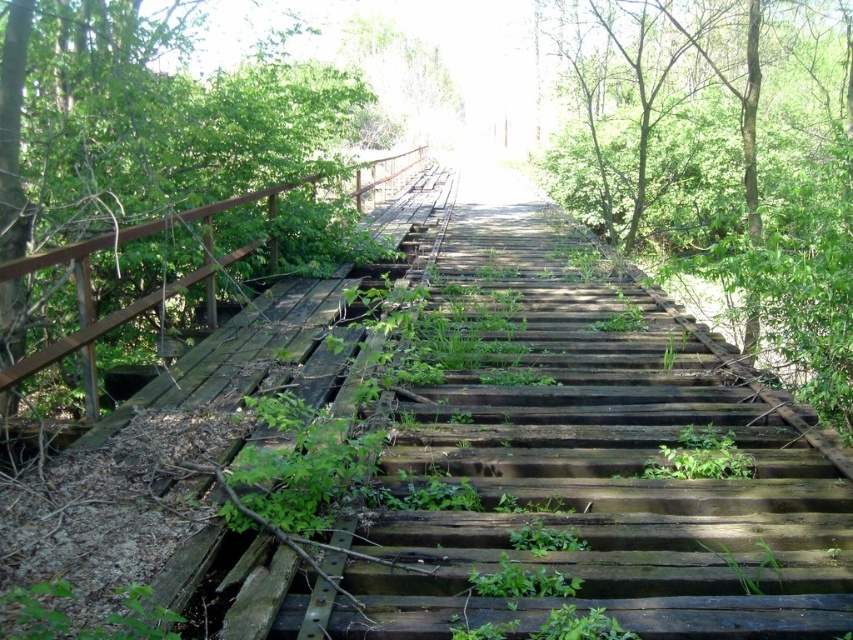
Question: Which object is farther from the camera taking this photo?

Choices:
 (A) green leafy tree at center
 (B) weathered wood stairs at center
 (C) green leafy tree at left

Answer: (C)

Question: Which is nearer to the green leafy tree at left?

Choices:
 (A) weathered wood stairs at center
 (B) green leafy tree at center

Answer: (A)

Question: Does green leafy tree at center appear under green leafy tree at left?

Choices:
 (A) no
 (B) yes

Answer: (A)

Question: Does weathered wood stairs at center appear under green leafy tree at center?

Choices:
 (A) yes
 (B) no

Answer: (A)

Question: Which of these objects is positioned closest to the weathered wood stairs at center?

Choices:
 (A) green leafy tree at left
 (B) green leafy tree at center

Answer: (A)

Question: Is weathered wood stairs at center smaller than green leafy tree at left?

Choices:
 (A) yes
 (B) no

Answer: (B)